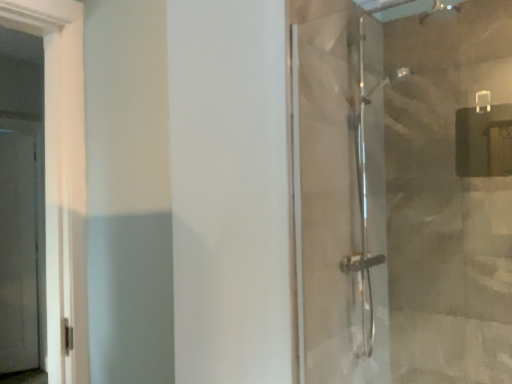
Question: Would you say clear glass screen door at left is inside or outside transparent glass shower door at right?

Choices:
 (A) outside
 (B) inside

Answer: (A)

Question: In the image, is clear glass screen door at left on the left side or the right side of transparent glass shower door at right?

Choices:
 (A) left
 (B) right

Answer: (A)

Question: From a real-world perspective, relative to transparent glass shower door at right, is clear glass screen door at left vertically above or below?

Choices:
 (A) above
 (B) below

Answer: (B)

Question: From their relative heights in the image, would you say transparent glass shower door at right is taller or shorter than clear glass screen door at left?

Choices:
 (A) short
 (B) tall

Answer: (A)

Question: Is transparent glass shower door at right inside the boundaries of clear glass screen door at left, or outside?

Choices:
 (A) outside
 (B) inside

Answer: (A)

Question: Does point (373, 183) appear closer or farther from the camera than point (18, 221)?

Choices:
 (A) farther
 (B) closer

Answer: (B)

Question: From the image's perspective, is transparent glass shower door at right above or below clear glass screen door at left?

Choices:
 (A) above
 (B) below

Answer: (A)